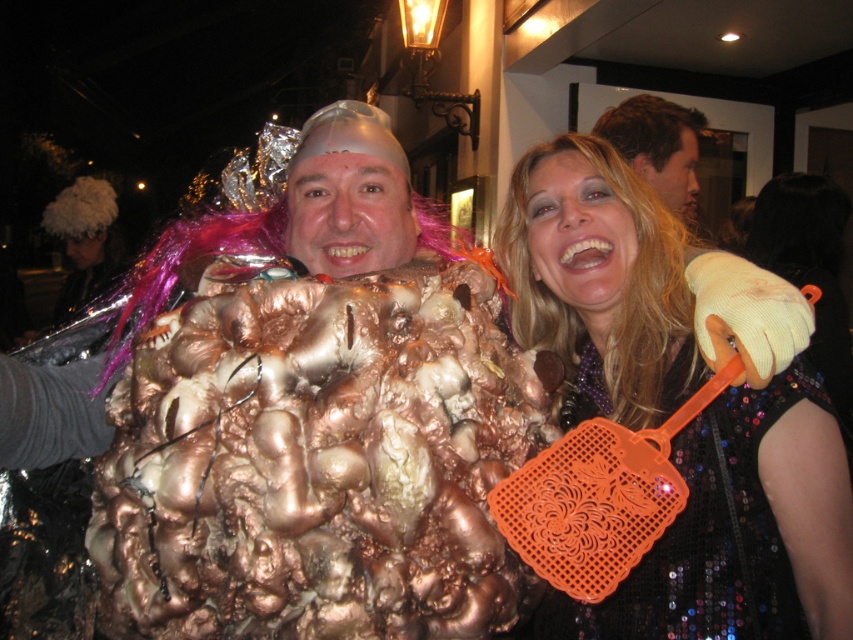
You are at a costume party and want to grab the orange plastic flyswatter at right to swat a fly near the blonde synthetic wig at upper right. Can you reach it without moving your position?

The orange plastic flyswatter at right is 4.78 inches away from the blonde synthetic wig at upper right. Since the distance is very short, you can likely reach it without moving your position.